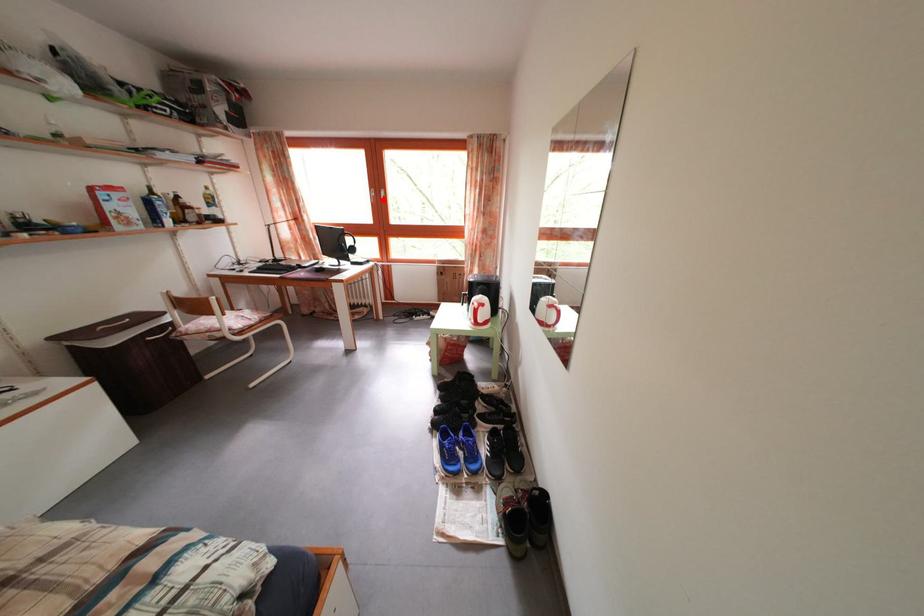
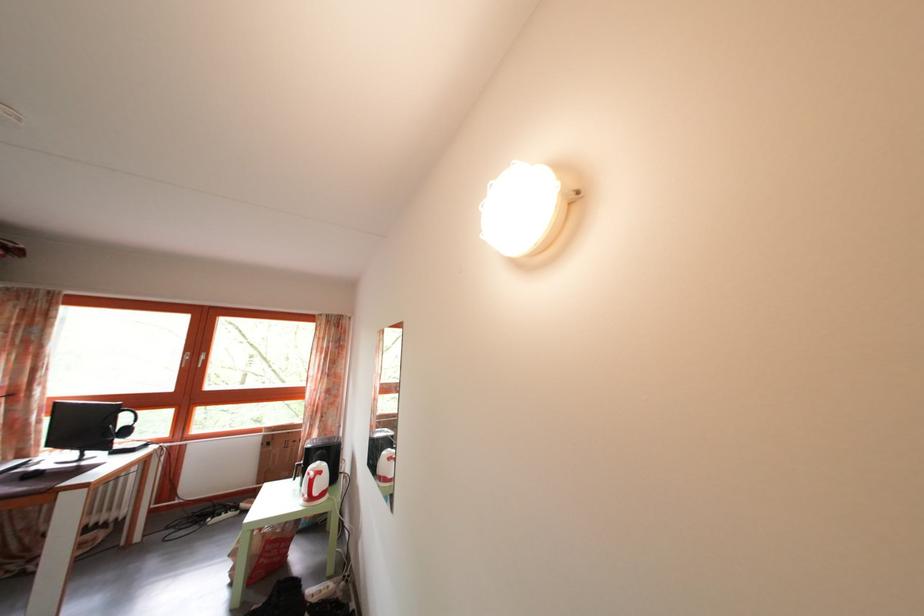
Question: I am providing you with two images of the same scene from different viewpoints. Image1 has a red point marked. In image2, the corresponding 3D location appears at what relative position? Reply with the corresponding letter.

Choices:
 (A) Closer
 (B) Farther

Answer: (B)